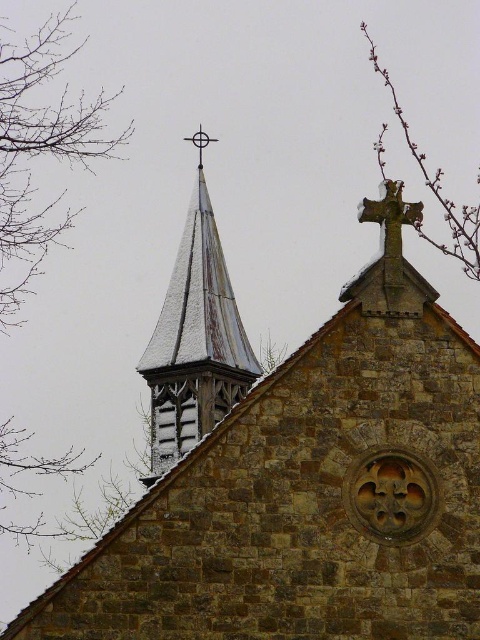
Does brown stone church steeple at upper left appear on the left side of white wooden spire at upper left?

No, brown stone church steeple at upper left is not to the left of white wooden spire at upper left.

Between brown stone church steeple at upper left and white wooden spire at upper left, which one is positioned lower?

brown stone church steeple at upper left is lower down.

Which is behind, point (386, 465) or point (218, 372)?

Point (218, 372)

This screenshot has width=480, height=640. In order to click on brown stone church steeple at upper left in this screenshot , I will do `click(296, 483)`.

Which is behind, point (189, 492) or point (454, 228)?

The point (454, 228) is behind.

Who is higher up, brown stone church steeple at upper left or brown textured cross at upper right?

Positioned higher is brown textured cross at upper right.

Between point (233, 512) and point (454, 250), which one is positioned behind?

Positioned behind is point (454, 250).

You are a GUI agent. You are given a task and a screenshot of the screen. Output one action in this format:
    pyautogui.click(x=<x>, y=<y>)
    Task: Click on the brown stone church steeple at upper left
    
    Given the screenshot: What is the action you would take?
    pyautogui.click(x=296, y=483)

Image resolution: width=480 pixels, height=640 pixels. What do you see at coordinates (436, 189) in the screenshot? I see `brown textured cross at upper right` at bounding box center [436, 189].

Is brown textured cross at upper right shorter than rusty metal cross at upper right?

Incorrect, brown textured cross at upper right's height does not fall short of rusty metal cross at upper right's.

Who is more distant from viewer, (x=396, y=100) or (x=396, y=220)?

Point (x=396, y=100)

This screenshot has height=640, width=480. Find the location of `brown textured cross at upper right`. brown textured cross at upper right is located at coordinates (436, 189).